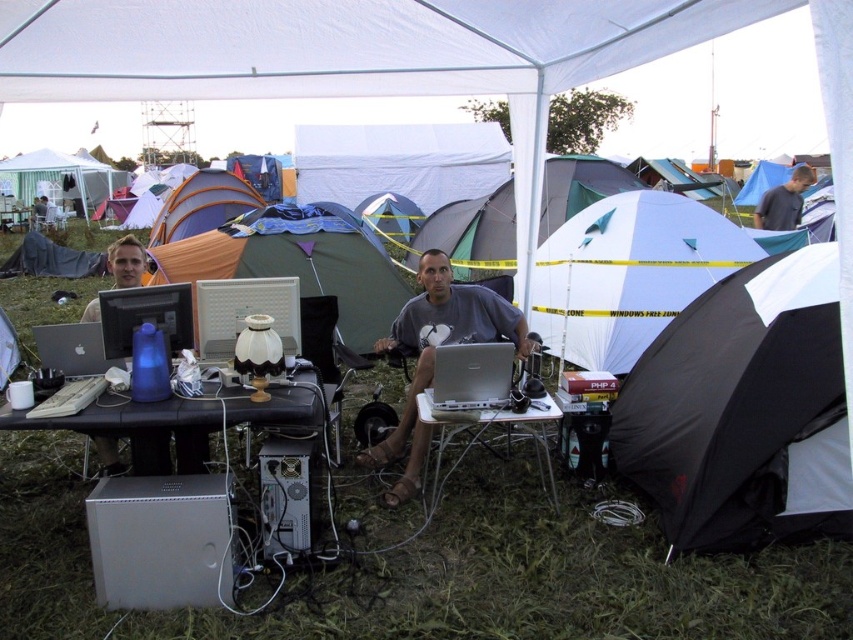
Does black fabric tent at lower right have a greater width compared to matte black laptop at center?

Yes.

Measure the distance from black fabric tent at lower right to matte black laptop at center.

They are 3.05 meters apart.

Where is `black fabric tent at lower right`? The height and width of the screenshot is (640, 853). black fabric tent at lower right is located at coordinates (741, 408).

Find the location of a particular element. The height and width of the screenshot is (640, 853). black fabric tent at lower right is located at coordinates coord(741,408).

Does matte black monitor at center appear over gray fabric shirt at center?

Incorrect, matte black monitor at center is not positioned above gray fabric shirt at center.

From the picture: Is the position of matte black monitor at center less distant than that of gray fabric shirt at center?

Yes, it is.

Between point (161, 312) and point (798, 164), which one is positioned behind?

Point (798, 164)

This screenshot has width=853, height=640. In order to click on matte black monitor at center in this screenshot , I will do `click(144, 316)`.

Is black fabric tent at lower right closer to the viewer compared to green canvas tent at center?

Yes, it is in front of green canvas tent at center.

Does black fabric tent at lower right have a lesser width compared to green canvas tent at center?

Correct, black fabric tent at lower right's width is less than green canvas tent at center's.

Between point (703, 545) and point (300, 250), which one is positioned behind?

The point (300, 250) is behind.

At what (x,y) coordinates should I click in order to perform the action: click on black fabric tent at lower right. Please return your answer as a coordinate pair (x, y). The height and width of the screenshot is (640, 853). Looking at the image, I should click on (741, 408).